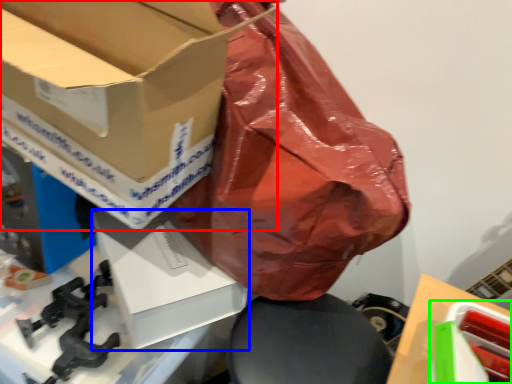
Question: Based on their relative distances, which object is nearer to box (highlighted by a red box)? Choose from box (highlighted by a blue box) and box (highlighted by a green box).

Choices:
 (A) box
 (B) box

Answer: (A)